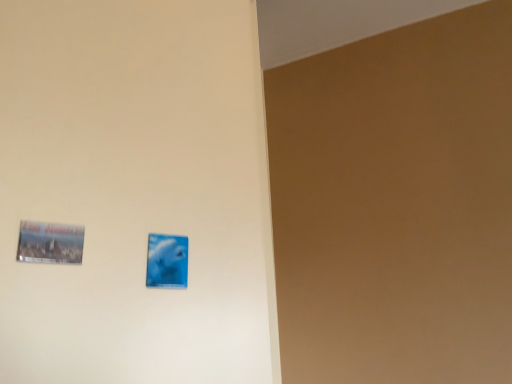
Question: In the image, is metallic silver picture frame at lower left, placed as the 1th picture frame when sorted from front to back, on the left side or the right side of blue glossy picture frame at center, the second picture frame from the front?

Choices:
 (A) left
 (B) right

Answer: (A)

Question: From a real-world perspective, is metallic silver picture frame at lower left, placed as the 1th picture frame when sorted from front to back, physically located above or below blue glossy picture frame at center, the second picture frame from the front?

Choices:
 (A) below
 (B) above

Answer: (B)

Question: Is point (53, 249) positioned closer to the camera than point (159, 238)?

Choices:
 (A) farther
 (B) closer

Answer: (B)

Question: In the image, is blue glossy picture frame at center, the second picture frame from the front, on the left side or the right side of metallic silver picture frame at lower left, placed as the 1th picture frame when sorted from front to back?

Choices:
 (A) right
 (B) left

Answer: (A)

Question: Is blue glossy picture frame at center, the second picture frame from the front, inside or outside of metallic silver picture frame at lower left, which is counted as the second picture frame, starting from the right?

Choices:
 (A) outside
 (B) inside

Answer: (A)

Question: Is point (169, 258) positioned closer to the camera than point (27, 226)?

Choices:
 (A) farther
 (B) closer

Answer: (A)

Question: Considering the positions of blue glossy picture frame at center, acting as the second picture frame starting from the left, and metallic silver picture frame at lower left, which is counted as the second picture frame, starting from the right, in the image, is blue glossy picture frame at center, acting as the second picture frame starting from the left, taller or shorter than metallic silver picture frame at lower left, which is counted as the second picture frame, starting from the right,?

Choices:
 (A) short
 (B) tall

Answer: (B)